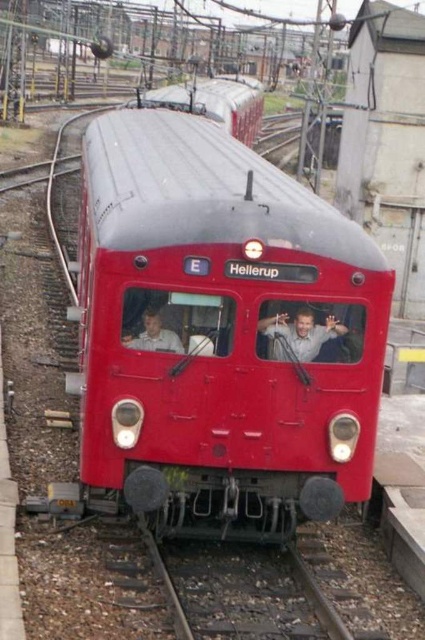
Does matte red train at center appear on the right side of light blue fabric shirt at center?

No, matte red train at center is not to the right of light blue fabric shirt at center.

Which is above, matte red train at center or light blue fabric shirt at center?

light blue fabric shirt at center is higher up.

What do you see at coordinates (220, 333) in the screenshot?
I see `matte red train at center` at bounding box center [220, 333].

Where is `matte red train at center`? matte red train at center is located at coordinates (220, 333).

Is matte red train at center bigger than light beige shirt at left?

No, matte red train at center is not bigger than light beige shirt at left.

The image size is (425, 640). In order to click on matte red train at center in this screenshot , I will do `click(220, 333)`.

I want to click on matte red train at center, so click(x=220, y=333).

In order to click on matte red train at center in this screenshot , I will do `click(220, 333)`.

Does light blue fabric shirt at center have a larger size compared to light beige shirt at left?

Yes.

Is light blue fabric shirt at center below light beige shirt at left?

Incorrect, light blue fabric shirt at center is not positioned below light beige shirt at left.

The image size is (425, 640). What do you see at coordinates (300, 333) in the screenshot?
I see `light blue fabric shirt at center` at bounding box center [300, 333].

I want to click on light blue fabric shirt at center, so click(x=300, y=333).